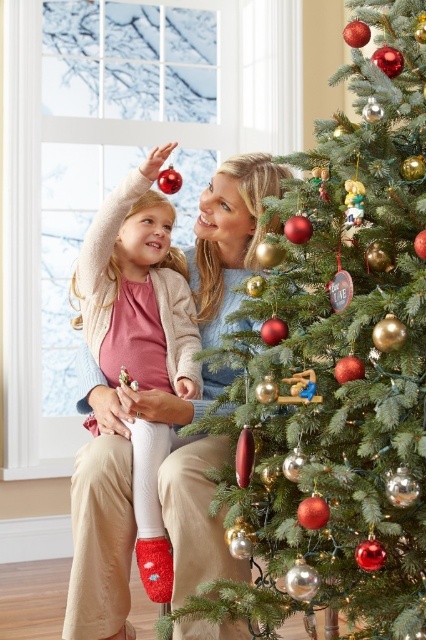
Where is `shiny gold ornaments at right`? This screenshot has height=640, width=426. shiny gold ornaments at right is located at coordinates (336, 364).

Who is positioned more to the right, shiny gold ornaments at right or matte pink sweater at upper left?

shiny gold ornaments at right is more to the right.

Between point (258, 502) and point (152, 195), which one is positioned behind?

Point (152, 195)

This screenshot has width=426, height=640. I want to click on shiny gold ornaments at right, so (x=336, y=364).